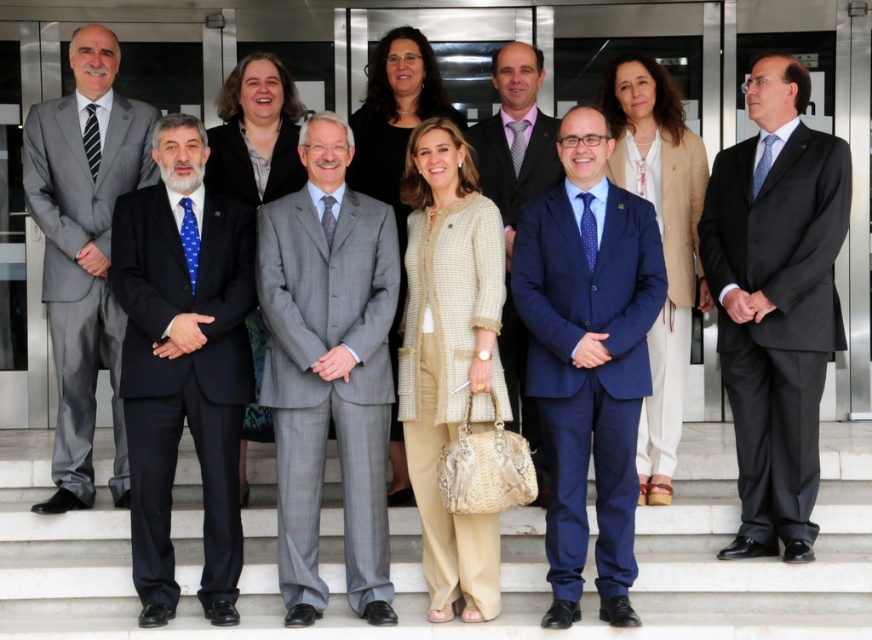
Question: Which point appears farthest from the camera in this image?

Choices:
 (A) (242, 125)
 (B) (419, 486)
 (C) (482, 128)
 (D) (387, 164)

Answer: (D)

Question: Which of the following is the farthest from the observer?

Choices:
 (A) beige tweed coat at center
 (B) beige textured blazer at center
 (C) beige textured coat at center
 (D) matte black coat at center

Answer: (D)

Question: Which point is closer to the camera?

Choices:
 (A) beige tweed coat at center
 (B) black silk suit at center
 (C) navy blue wool suit at center

Answer: (C)

Question: Can you confirm if black silk suit at center is thinner than beige tweed coat at center?

Choices:
 (A) yes
 (B) no

Answer: (B)

Question: Is black silk suit at center thinner than beige textured blazer at center?

Choices:
 (A) yes
 (B) no

Answer: (B)

Question: Is beige textured blazer at center thinner than matte purple tie at center?

Choices:
 (A) yes
 (B) no

Answer: (B)